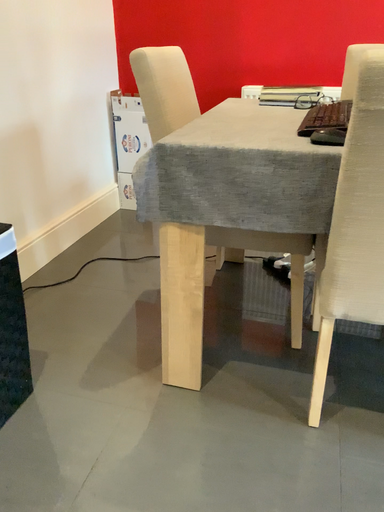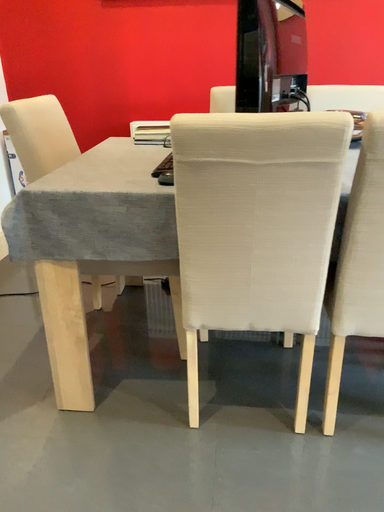
Question: How did the camera likely rotate when shooting the video?

Choices:
 (A) rotated left
 (B) rotated right

Answer: (B)